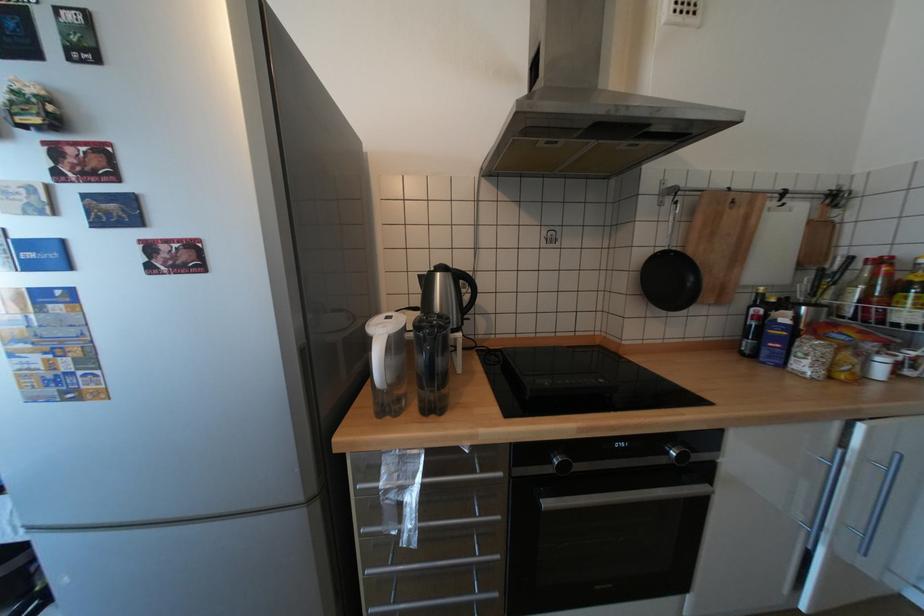
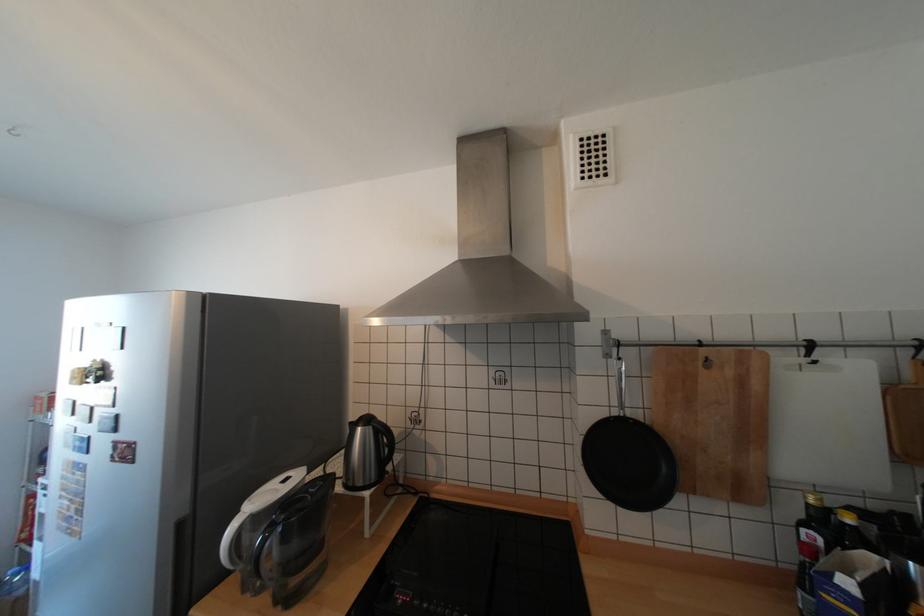
In the second image, find the point that corresponds to (x=751, y=211) in the first image.

(738, 371)